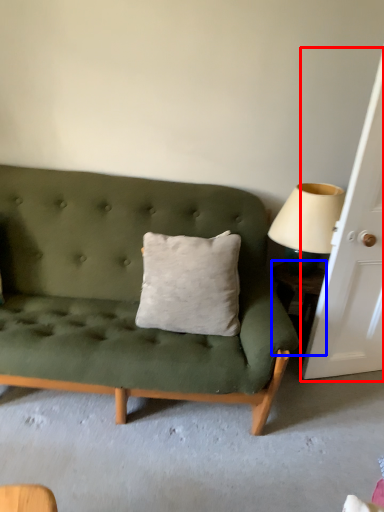
Question: Which object appears farthest to the camera in this image, door (highlighted by a red box) or table (highlighted by a blue box)?

Choices:
 (A) door
 (B) table

Answer: (B)